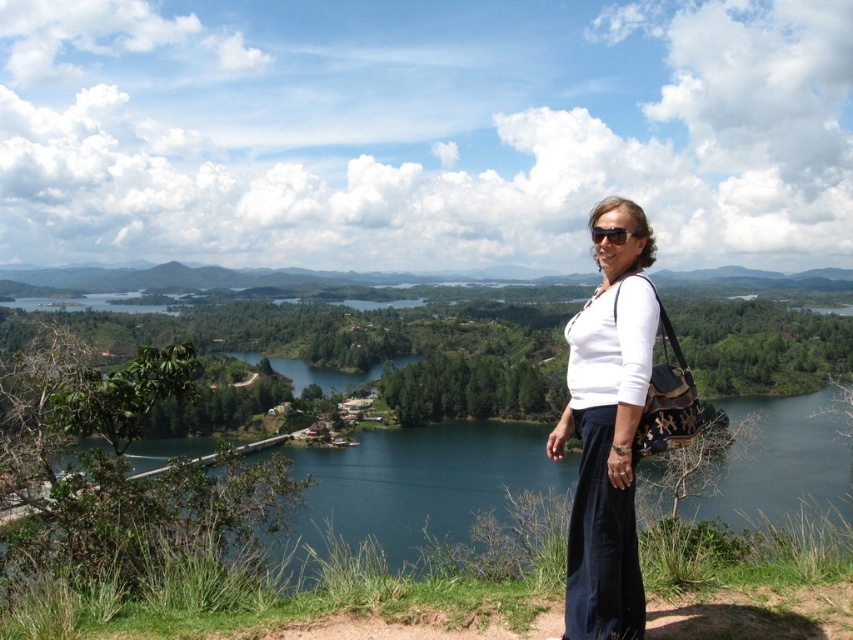
Question: Which point is farther to the camera?

Choices:
 (A) white matte shirt at center
 (B) matte black sunglasses at center
 (C) blue water at center

Answer: (C)

Question: Which point is farther from the camera taking this photo?

Choices:
 (A) (616, 214)
 (B) (848, 452)
 (C) (621, 236)

Answer: (B)

Question: Does blue water at center come behind white matte shirt at center?

Choices:
 (A) no
 (B) yes

Answer: (B)

Question: Which is farther from the white matte shirt at center?

Choices:
 (A) matte black sunglasses at center
 (B) blue water at center

Answer: (B)

Question: Can you confirm if blue water at center is wider than matte black sunglasses at center?

Choices:
 (A) no
 (B) yes

Answer: (B)

Question: Does blue water at center appear on the right side of matte black sunglasses at center?

Choices:
 (A) no
 (B) yes

Answer: (B)